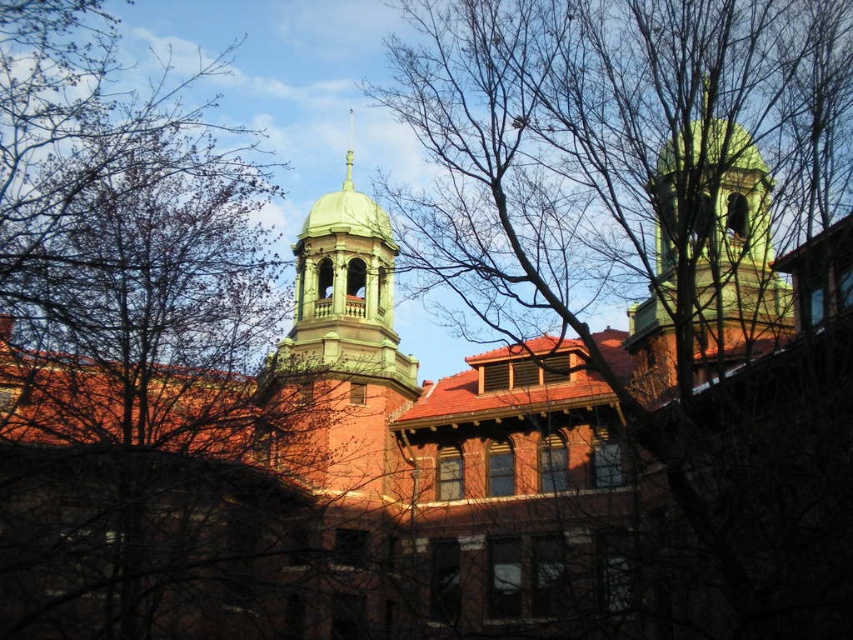
Question: Estimate the real-world distances between objects in this image. Which object is closer to the bare branches at upper center?

Choices:
 (A) bare branches at upper left
 (B) green polished spire at upper center

Answer: (A)

Question: Does bare branches at upper left have a lesser width compared to bare branches at upper center?

Choices:
 (A) yes
 (B) no

Answer: (A)

Question: Estimate the real-world distances between objects in this image. Which object is farther from the bare branches at upper center?

Choices:
 (A) bare branches at upper left
 (B) green polished spire at upper center

Answer: (B)

Question: From the image, what is the correct spatial relationship of bare branches at upper center in relation to green polished spire at upper center?

Choices:
 (A) above
 (B) below

Answer: (B)

Question: Estimate the real-world distances between objects in this image. Which object is closer to the bare branches at upper left?

Choices:
 (A) green polished spire at upper center
 (B) bare branches at upper center

Answer: (B)

Question: Does bare branches at upper left appear on the left side of green polished spire at upper center?

Choices:
 (A) no
 (B) yes

Answer: (B)